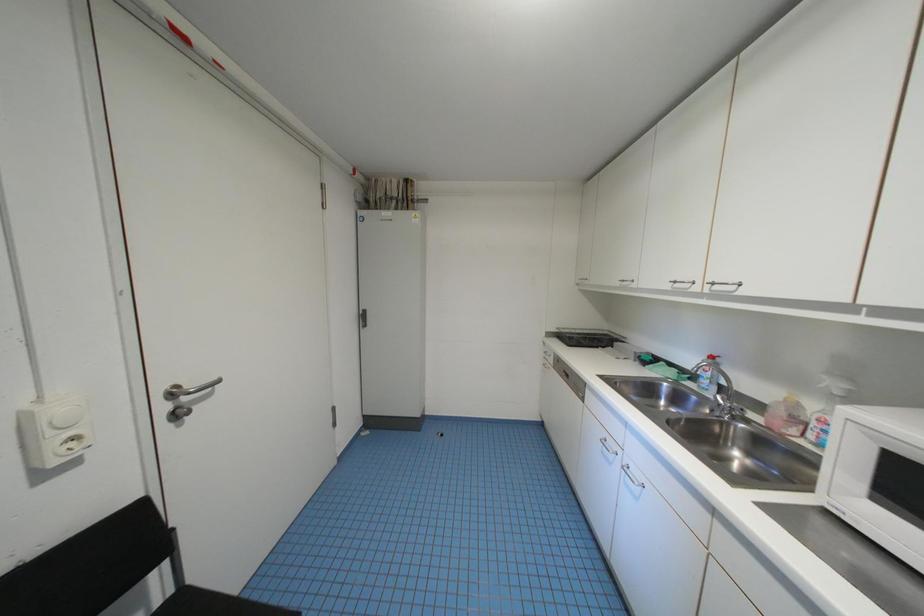
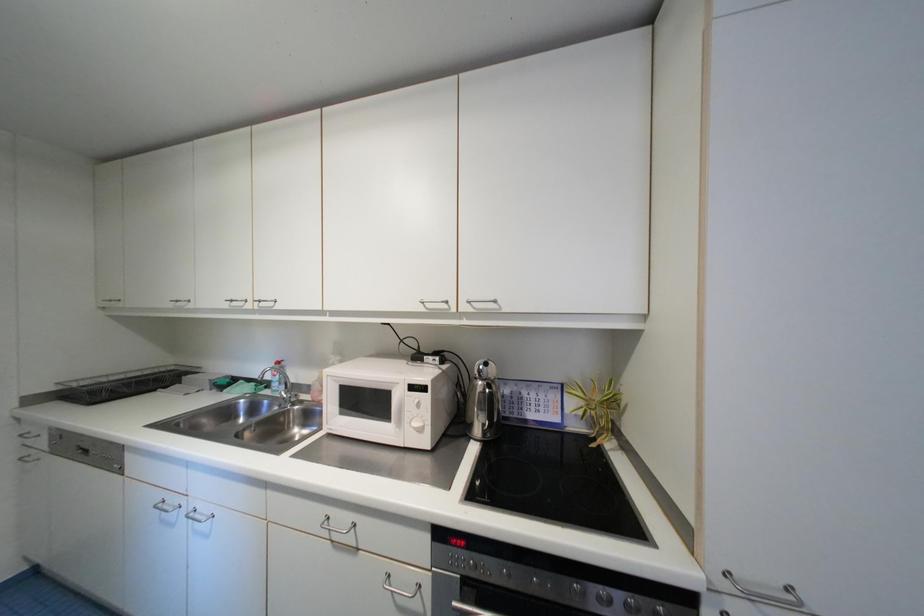
Question: The first image is from the beginning of the video and the second image is from the end. How did the camera likely rotate when shooting the video?

Choices:
 (A) Left
 (B) Right
 (C) Up
 (D) Down

Answer: (B)